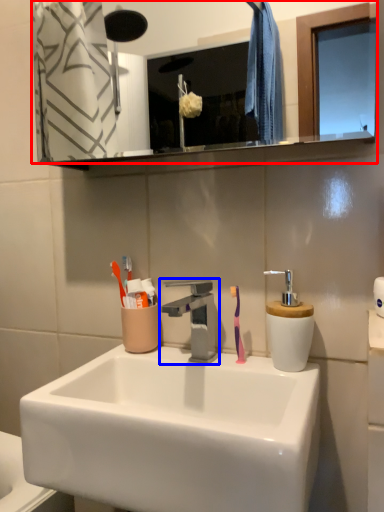
Question: Which object is closer to the camera taking this photo, mirror (highlighted by a red box) or tap (highlighted by a blue box)?

Choices:
 (A) mirror
 (B) tap

Answer: (A)